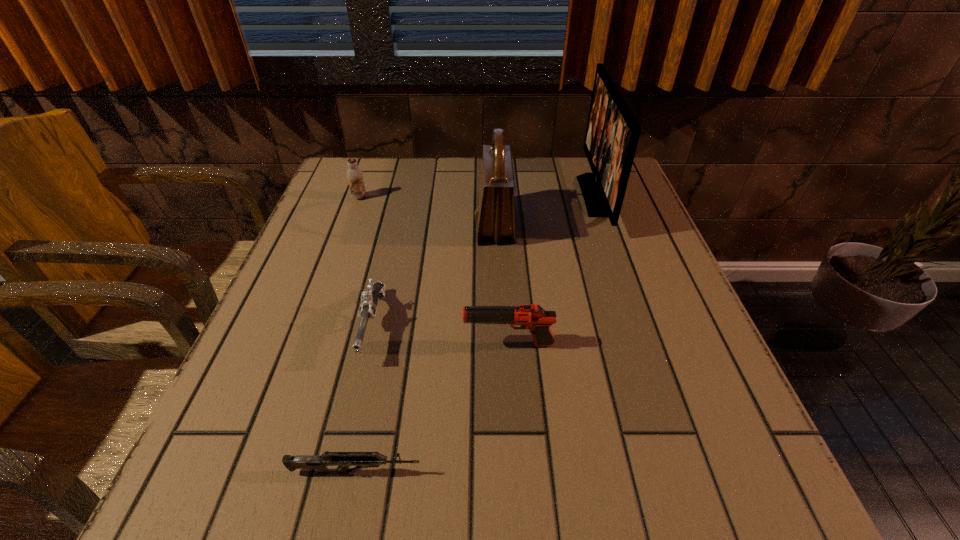
I want to click on free space at the left edge, so click(x=286, y=320).

Where is `free location at the right edge of the desktop`? Image resolution: width=960 pixels, height=540 pixels. free location at the right edge of the desktop is located at coordinates (729, 431).

You are a GUI agent. You are given a task and a screenshot of the screen. Output one action in this format:
    pyautogui.click(x=<x>, y=<y>)
    Task: Click on the vacant space at the far left corner of the desktop
    The image size is (960, 540).
    Given the screenshot: What is the action you would take?
    pyautogui.click(x=382, y=169)

In order to click on free region at the near right corner of the desktop in this screenshot , I will do (734, 471).

Locate an element on the screen. Image resolution: width=960 pixels, height=540 pixels. vacant region between the tallest gun and the second tallest gun is located at coordinates (441, 335).

The height and width of the screenshot is (540, 960). I want to click on free space between the second tallest gun and the nearest object, so click(x=364, y=399).

This screenshot has width=960, height=540. I want to click on vacant region between the nearest gun and the fifth shortest object, so click(x=425, y=348).

Find the location of a particular element. This screenshot has height=540, width=960. free spot between the tallest gun and the shortest object is located at coordinates (432, 408).

Find the location of a particular element. free space that is in between the rightmost object and the second shortest object is located at coordinates (484, 261).

Locate an element on the screen. This screenshot has width=960, height=540. vacant area that lies between the fifth shortest object and the leftmost object is located at coordinates (427, 211).